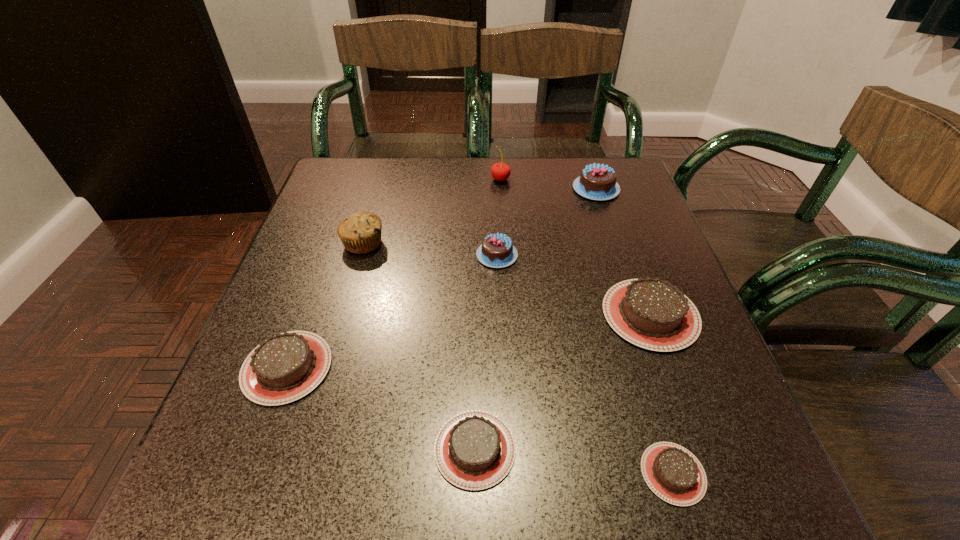
Where is `the second shortest object`? The width and height of the screenshot is (960, 540). the second shortest object is located at coordinates (474, 450).

At what (x,y) coordinates should I click in order to perform the action: click on the second smallest brown chocolate cake. Please return your answer as a coordinate pair (x, y). Image resolution: width=960 pixels, height=540 pixels. Looking at the image, I should click on (474, 450).

Locate an element on the screen. the shortest object is located at coordinates (673, 473).

Locate an element on the screen. the shortest chocolate cake is located at coordinates (673, 473).

This screenshot has height=540, width=960. What are the coordinates of `vacant space located on the right of the red cherry` in the screenshot? It's located at (529, 179).

Locate an element on the screen. The height and width of the screenshot is (540, 960). free space located 0.330m on the right of the seventh shortest object is located at coordinates (533, 244).

Where is `free space located on the front of the farther pink chocolate cake`? Image resolution: width=960 pixels, height=540 pixels. free space located on the front of the farther pink chocolate cake is located at coordinates (630, 291).

This screenshot has width=960, height=540. I want to click on vacant region located on the back of the fifth nearest chocolate cake, so click(x=493, y=170).

In order to click on free space located 0.230m on the front of the biggest brown chocolate cake in this screenshot , I will do `click(713, 491)`.

Find the location of a particular element. vacant space positioned 0.400m on the back of the second biggest brown chocolate cake is located at coordinates (347, 204).